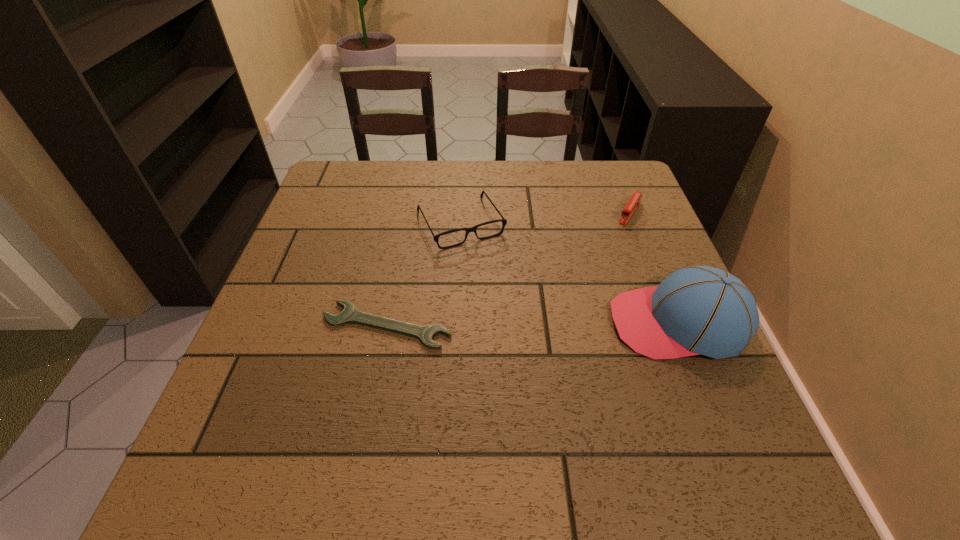
In order to click on vacant region at the far edge of the desktop in this screenshot , I will do `click(536, 163)`.

The image size is (960, 540). In the image, there is a desktop. What are the coordinates of `free space at the near edge` in the screenshot? It's located at (481, 401).

Where is `vacant space at the left edge`? This screenshot has height=540, width=960. vacant space at the left edge is located at coordinates (306, 226).

Find the location of a particular element. This screenshot has height=540, width=960. vacant space at the right edge of the desktop is located at coordinates (636, 264).

At what (x,y) coordinates should I click in order to perform the action: click on vacant position at the far left corner of the desktop. Please return your answer as a coordinate pair (x, y). The width and height of the screenshot is (960, 540). Looking at the image, I should click on (320, 192).

Locate an element on the screen. This screenshot has height=540, width=960. vacant space at the near left corner is located at coordinates (292, 394).

Where is `vacant space that's between the spectacles and the stapler`? This screenshot has height=540, width=960. vacant space that's between the spectacles and the stapler is located at coordinates (545, 218).

This screenshot has height=540, width=960. I want to click on vacant space that is in between the spectacles and the stapler, so click(x=545, y=218).

You are a GUI agent. You are given a task and a screenshot of the screen. Output one action in this format:
    pyautogui.click(x=<x>, y=<y>)
    Task: Click on the empty space that is in between the stapler and the baseball cap
    This screenshot has height=540, width=960.
    Given the screenshot: What is the action you would take?
    pyautogui.click(x=654, y=268)

Locate an element on the screen. This screenshot has width=960, height=540. vacant region between the tallest object and the stapler is located at coordinates (654, 268).